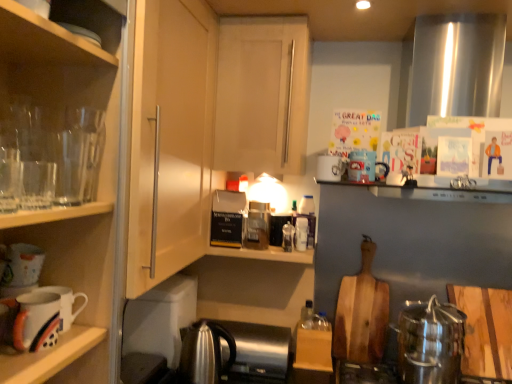
Identify the location of empty space that is ontop of satin silver kettle at lower center (from a real-world perspective). (248, 331).